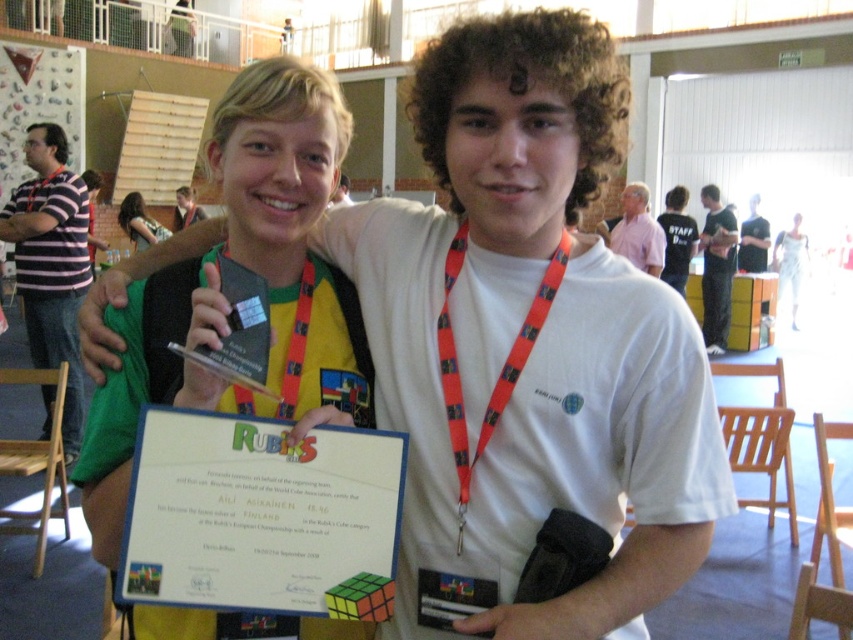
Is point (521, 232) behind point (194, 221)?

No.

Identify the location of orange lanyard at center. (515, 225).

Measure the distance between point (635, 212) and camera.

Point (635, 212) and camera are 6.80 meters apart.

Does pink fabric shirt at upper center have a lesser width compared to matte black shirt at center?

Yes, pink fabric shirt at upper center is thinner than matte black shirt at center.

I want to click on pink fabric shirt at upper center, so click(x=637, y=230).

Identify the location of pink fabric shirt at upper center. The image size is (853, 640). (637, 230).

Who is higher up, orange fabric lanyard at center or matte black shirt at center?

matte black shirt at center is above.

Is point (509, 378) in front of point (177, 224)?

Yes.

Where is `orange fabric lanyard at center`? This screenshot has width=853, height=640. orange fabric lanyard at center is located at coordinates (502, 368).